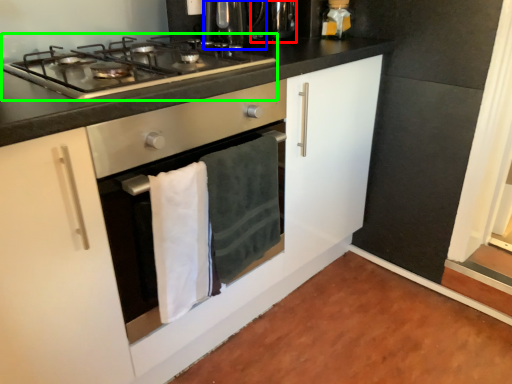
Question: Which object is the farthest from appliance (highlighted by a red box)? Choose among these: coffee machine (highlighted by a blue box) or gas stove (highlighted by a green box).

Choices:
 (A) coffee machine
 (B) gas stove

Answer: (B)